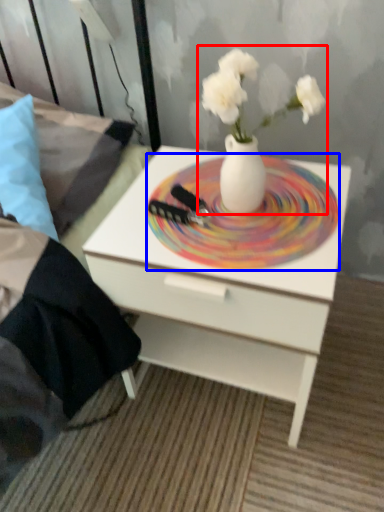
Question: Which object is further to the camera taking this photo, floral arrangement (highlighted by a red box) or plate (highlighted by a blue box)?

Choices:
 (A) floral arrangement
 (B) plate

Answer: (B)